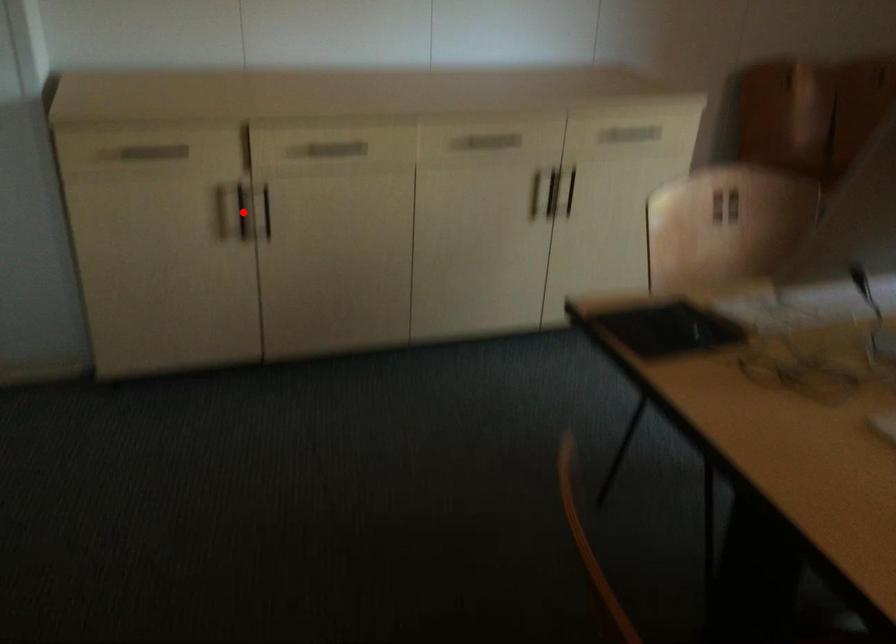
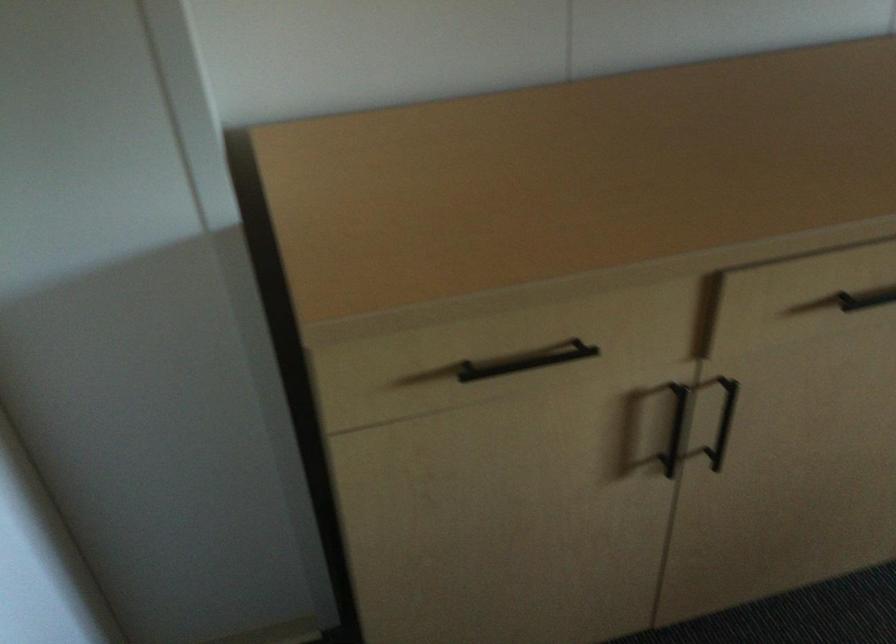
Where in the second image is the point corresponding to the highlighted location from the first image?

(675, 428)